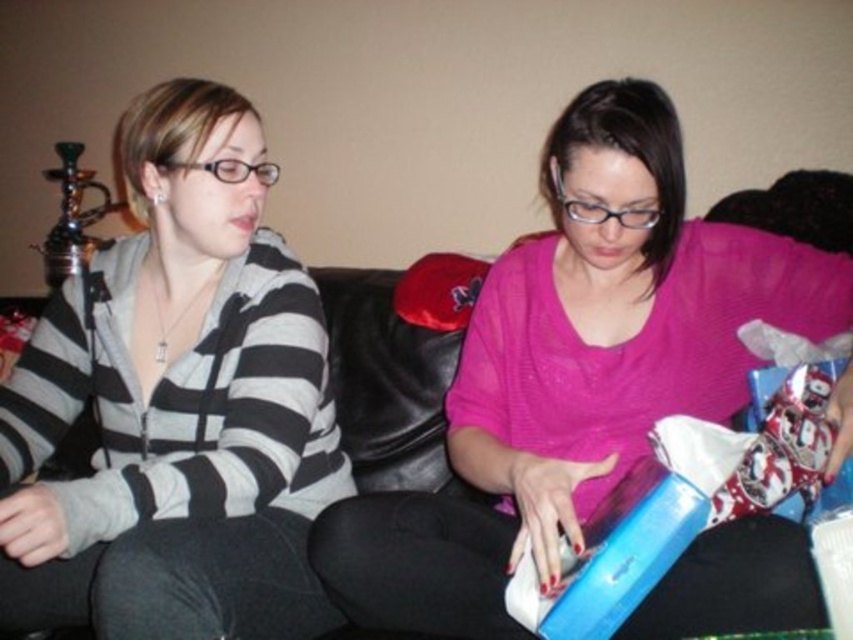
Question: Which point is farther to the camera?

Choices:
 (A) (508, 461)
 (B) (461, 477)
 (C) (45, 317)

Answer: (C)

Question: Can you confirm if pink sheer sweater at center is positioned below black leather couch at center?

Choices:
 (A) no
 (B) yes

Answer: (A)

Question: Which object is the farthest from the pink sheer sweater at center?

Choices:
 (A) matte gray hoodie at left
 (B) black leather couch at center

Answer: (A)

Question: Is matte gray hoodie at left smaller than black leather couch at center?

Choices:
 (A) yes
 (B) no

Answer: (B)

Question: Which point is closer to the camera?

Choices:
 (A) 840,376
 (B) 521,483

Answer: (B)

Question: Is matte gray hoodie at left in front of black leather couch at center?

Choices:
 (A) no
 (B) yes

Answer: (B)